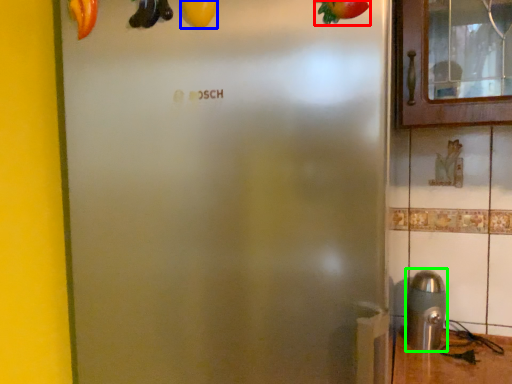
Question: Which object is the farthest from fruit (highlighted by a red box)? Choose among these: fruit (highlighted by a blue box) or stainless steel (highlighted by a green box).

Choices:
 (A) fruit
 (B) stainless steel

Answer: (B)